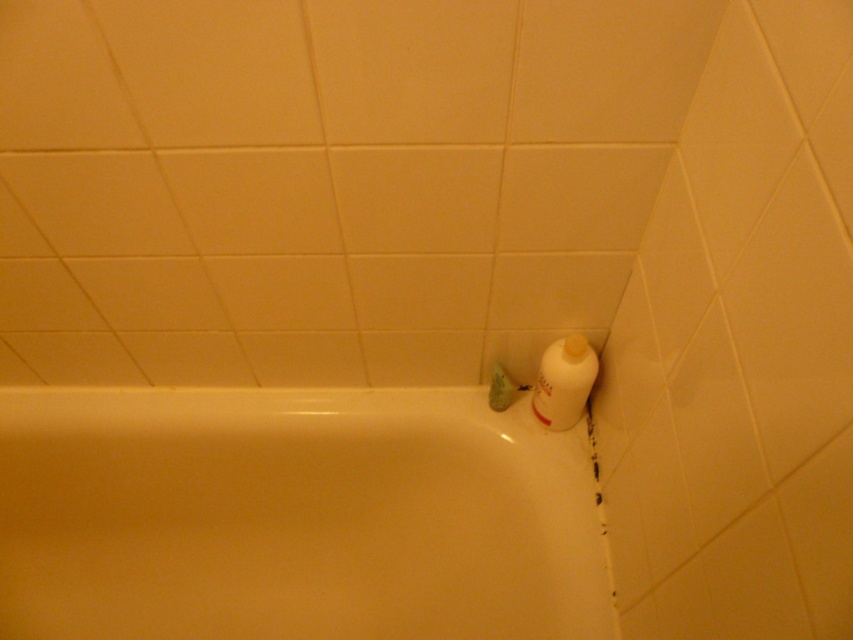
Who is more distant from viewer, (419,433) or (544,406)?

The point (419,433) is behind.

What do you see at coordinates (293, 516) in the screenshot? Image resolution: width=853 pixels, height=640 pixels. I see `white glossy bathtub at lower left` at bounding box center [293, 516].

Between point (109, 500) and point (553, 426), which one is positioned in front?

Point (553, 426) is in front.

Where is `white glossy bathtub at lower left`? white glossy bathtub at lower left is located at coordinates (293, 516).

Is white plastic bottle at upper right in front of green matte soap at corner?

That is True.

Between white plastic bottle at upper right and green matte soap at corner, which one is positioned higher?

white plastic bottle at upper right

I want to click on white plastic bottle at upper right, so click(563, 381).

Between point (120, 557) and point (496, 390), which one is positioned in front?

Point (496, 390) is in front.

Between white glossy bathtub at lower left and green matte soap at corner, which one appears on the right side from the viewer's perspective?

green matte soap at corner

You are a GUI agent. You are given a task and a screenshot of the screen. Output one action in this format:
    pyautogui.click(x=<x>, y=<y>)
    Task: Click on the white glossy bathtub at lower left
    The height and width of the screenshot is (640, 853).
    Given the screenshot: What is the action you would take?
    pyautogui.click(x=293, y=516)